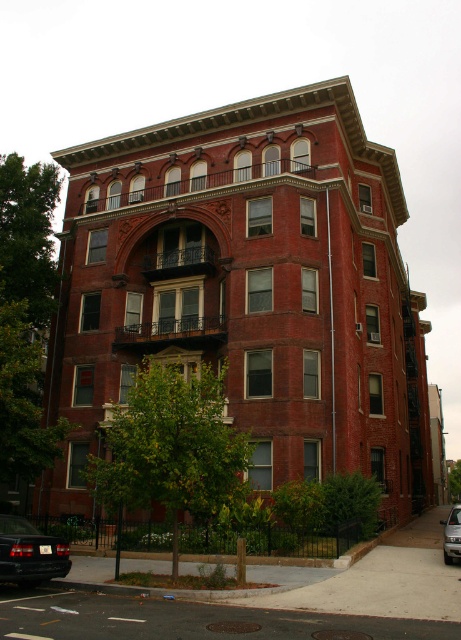
Can you confirm if matte black car at lower left is shorter than satin silver car at lower right?

Yes.

Find the location of a particular element. matte black car at lower left is located at coordinates (29, 552).